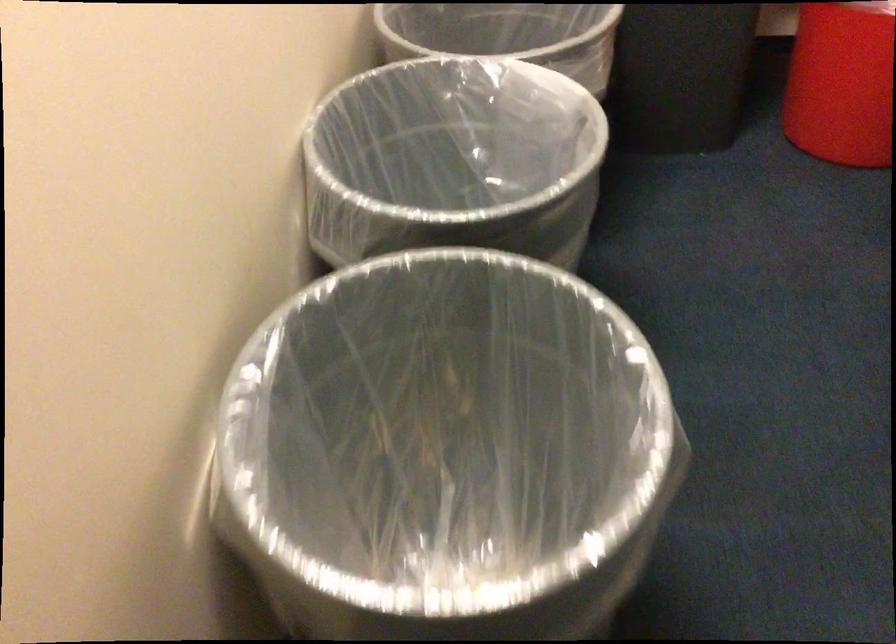
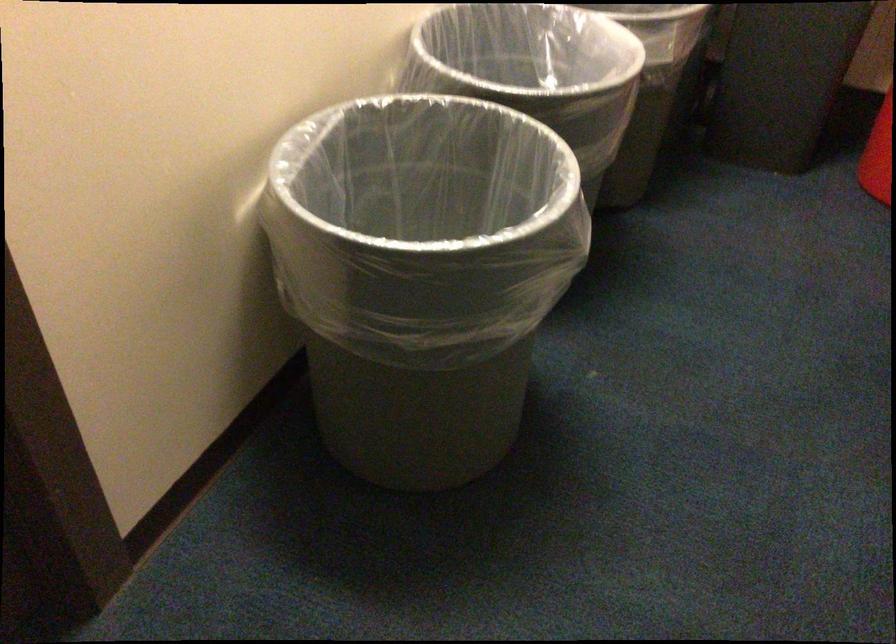
Find the pixel in the second image that matches the point at 487,133 in the first image.

(562, 67)